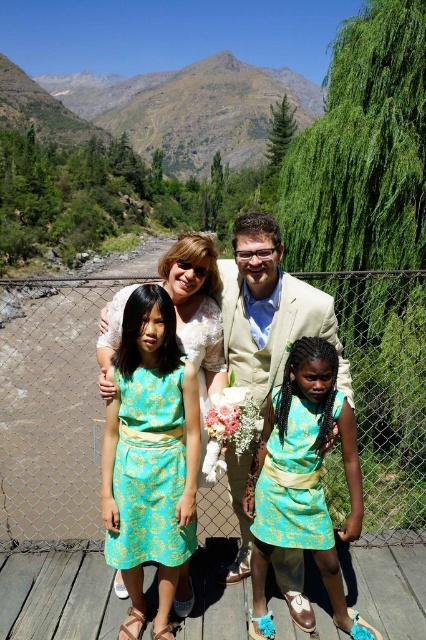
Question: Does turquoise brocade dress at center have a greater width compared to teal brocade dress at center?

Choices:
 (A) yes
 (B) no

Answer: (B)

Question: Estimate the real-world distances between objects in this image. Which object is farther from the light beige suit at center?

Choices:
 (A) teal floral dress at center
 (B) teal brocade dress at center

Answer: (B)

Question: Can you confirm if teal brocade dress at center is positioned above light beige suit at center?

Choices:
 (A) yes
 (B) no

Answer: (B)

Question: From the image, what is the correct spatial relationship of teal floral dress at center in relation to light beige suit at center?

Choices:
 (A) left
 (B) right

Answer: (A)

Question: Which object is positioned closest to the teal floral dress at center?

Choices:
 (A) light beige suit at center
 (B) teal brocade dress at center
 (C) turquoise brocade dress at center

Answer: (A)

Question: Among these points, which one is farthest from the camera?

Choices:
 (A) (239, 483)
 (B) (296, 336)
 (C) (321, 396)
 (D) (192, 492)

Answer: (A)